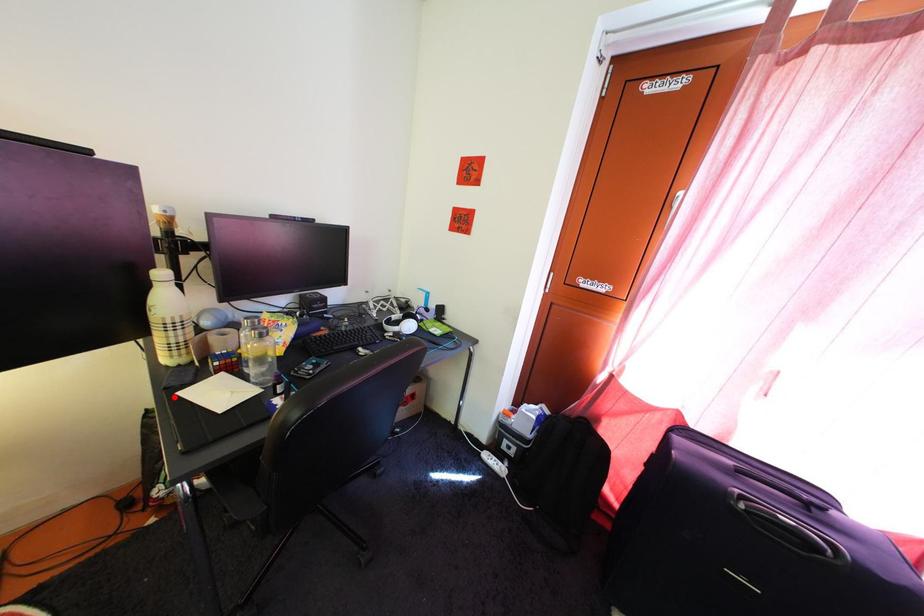
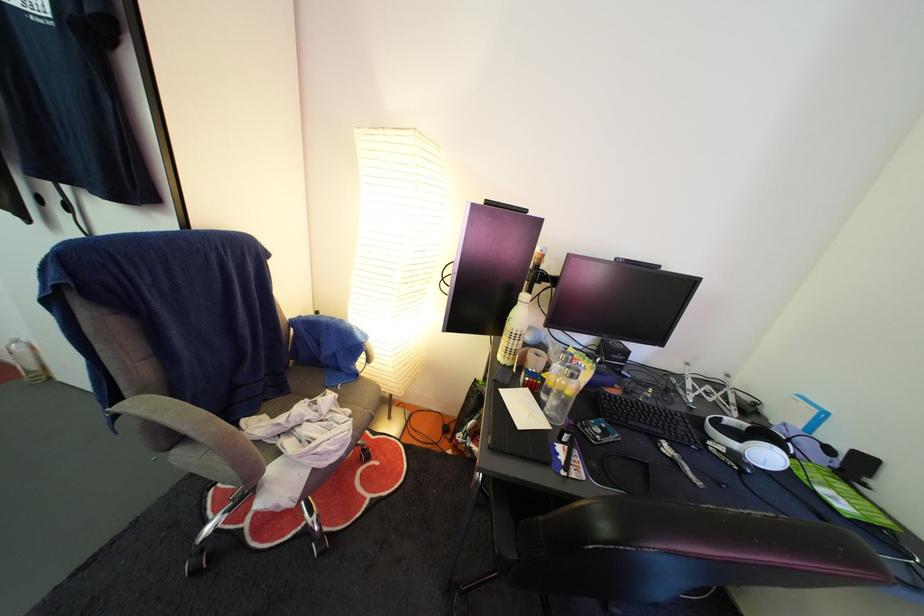
The point at the highlighted location is marked in the first image. Where is the corresponding point in the second image?

(504, 389)